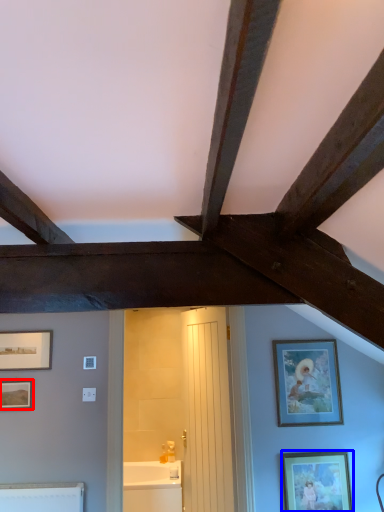
Question: Which object appears farthest to the camera in this image, picture frame (highlighted by a red box) or picture frame (highlighted by a blue box)?

Choices:
 (A) picture frame
 (B) picture frame

Answer: (A)